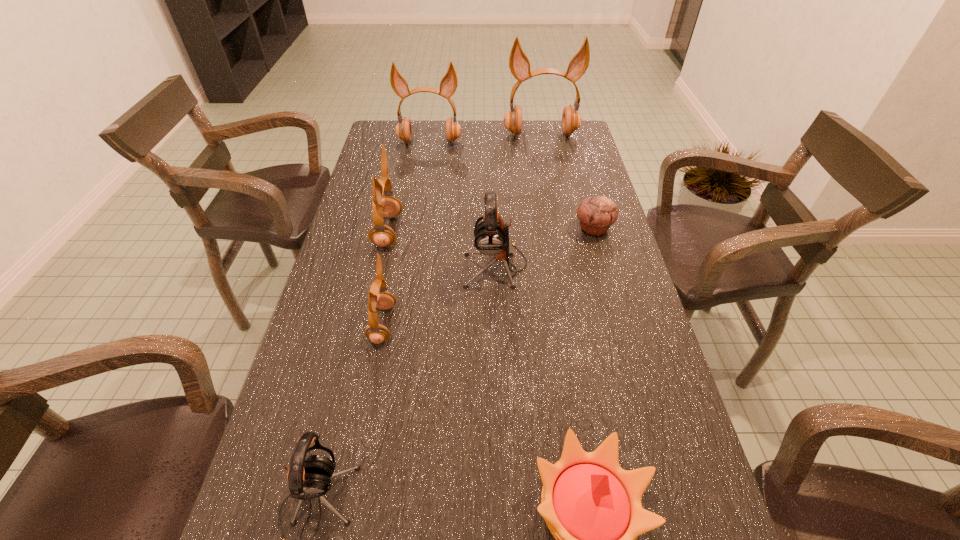
Where is `vacant area at the far edge`? Image resolution: width=960 pixels, height=540 pixels. vacant area at the far edge is located at coordinates (507, 138).

At what (x,y) coordinates should I click in order to perform the action: click on blank area at the left edge. Please return your answer as a coordinate pair (x, y). Looking at the image, I should click on (405, 163).

Where is `free space at the right edge of the desktop`? Image resolution: width=960 pixels, height=540 pixels. free space at the right edge of the desktop is located at coordinates (573, 255).

In the image, there is a desktop. In order to click on vacant space at the far right corner in this screenshot , I will do `click(558, 152)`.

I want to click on free point between the farther black earphone and the second smallest brown earphone, so click(442, 248).

You are a GUI agent. You are given a task and a screenshot of the screen. Output one action in this format:
    pyautogui.click(x=<x>, y=<y>)
    Task: Click on the free space between the rightmost brown earphone and the right black earphone
    This screenshot has height=540, width=960.
    Given the screenshot: What is the action you would take?
    pyautogui.click(x=518, y=200)

Locate an element on the screen. The height and width of the screenshot is (540, 960). free space between the second nearest brown earphone and the third smallest brown earphone is located at coordinates (409, 187).

Where is `object that stands as the sixth closest to the fifth shortest earphone`? This screenshot has height=540, width=960. object that stands as the sixth closest to the fifth shortest earphone is located at coordinates (592, 507).

You are a GUI agent. You are given a task and a screenshot of the screen. Output one action in this format:
    pyautogui.click(x=<x>, y=<y>)
    Task: Click on the sixth closest object relative to the tallest object
    
    Given the screenshot: What is the action you would take?
    coord(592,507)

Find the location of a particular element. Image resolution: width=960 pixels, height=540 pixels. earphone that is the closest to the nearer black earphone is located at coordinates (377, 333).